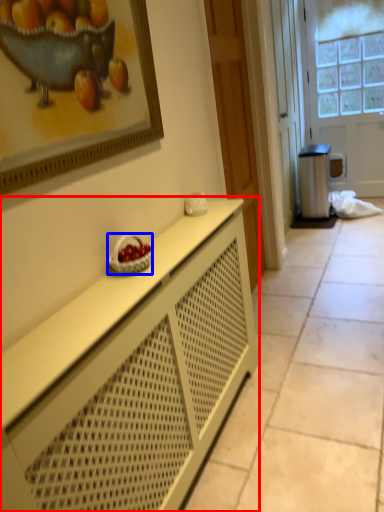
Question: Which object appears closest to the camera in this image, cabinetry (highlighted by a red box) or fruit dish (highlighted by a blue box)?

Choices:
 (A) cabinetry
 (B) fruit dish

Answer: (A)